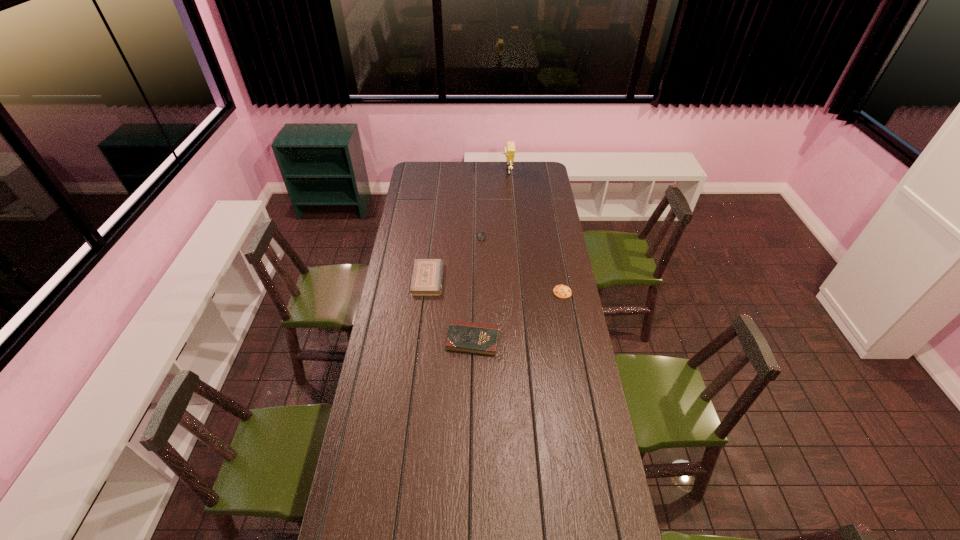
At what (x,y) coordinates should I click in order to perform the action: click on free point located on the face of the sponge. Please return your answer as a coordinate pair (x, y). Looking at the image, I should click on (456, 172).

Locate an element on the screen. free region located on the face of the sponge is located at coordinates [x=487, y=172].

You are a GUI agent. You are given a task and a screenshot of the screen. Output one action in this format:
    pyautogui.click(x=<x>, y=<y>)
    Task: Click on the free location located on the face of the sponge
    
    Given the screenshot: What is the action you would take?
    pyautogui.click(x=493, y=172)

In order to click on free space located 0.200m on the spine side of the left Bible in this screenshot , I will do `click(484, 279)`.

I want to click on free spot located 0.290m on the left of the nearer Bible, so click(x=379, y=340).

Where is `free space located on the left of the fourth nearest object`? free space located on the left of the fourth nearest object is located at coordinates (x=457, y=238).

At what (x,y) coordinates should I click in order to perform the action: click on vacant space located on the left of the shortest object. Please return your answer as a coordinate pair (x, y). Looking at the image, I should click on pos(542,292).

This screenshot has height=540, width=960. Find the location of `object positioned at the far edge`. object positioned at the far edge is located at coordinates (509, 150).

I want to click on object positioned at the left edge, so click(427, 277).

You are a GUI agent. You are given a task and a screenshot of the screen. Output one action in this format:
    pyautogui.click(x=<x>, y=<y>)
    Task: Click on the object that is at the right edge
    The height and width of the screenshot is (540, 960).
    Given the screenshot: What is the action you would take?
    pyautogui.click(x=561, y=291)